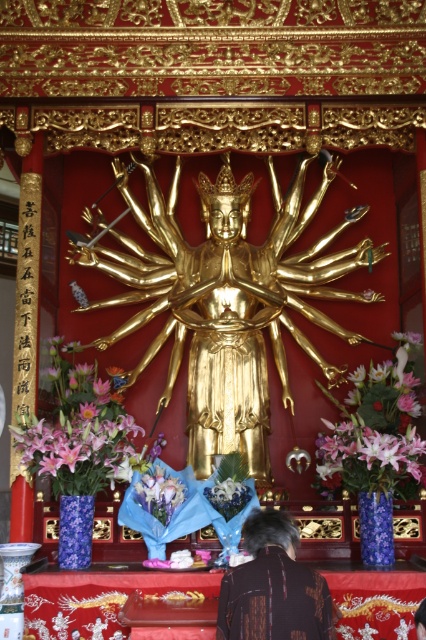
Question: Which point is closer to the camera?

Choices:
 (A) pink silk flowers at lower left
 (B) pink silk flowers at center

Answer: (A)

Question: Which of these objects is positioned closest to the pastel purple bouquet at center?

Choices:
 (A) brown textured shirt at lower center
 (B) gold polished statue at center
 (C) pink silk flowers at center

Answer: (A)

Question: Is pink silk flowers at lower left bigger than silky blue bouquet at lower center?

Choices:
 (A) yes
 (B) no

Answer: (A)

Question: Is pink silk flowers at lower left above silky blue bouquet at lower center?

Choices:
 (A) yes
 (B) no

Answer: (A)

Question: Does pink silk flowers at lower left come in front of pink silk flowers at center?

Choices:
 (A) no
 (B) yes

Answer: (B)

Question: Estimate the real-world distances between objects in this image. Which object is closer to the silky blue bouquet at lower center?

Choices:
 (A) gold polished statue at center
 (B) pink silk flowers at lower left

Answer: (B)